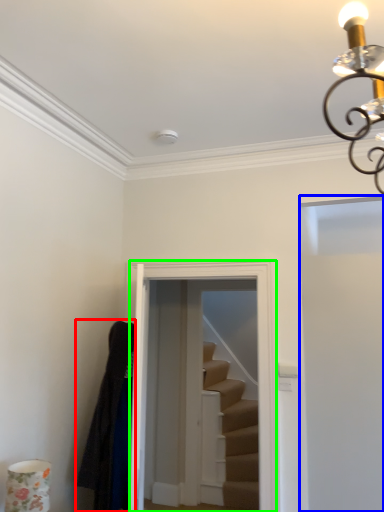
Question: Based on their relative distances, which object is farther from robe (highlighted by a red box)? Choose from door (highlighted by a blue box) and glass door (highlighted by a green box).

Choices:
 (A) door
 (B) glass door

Answer: (A)